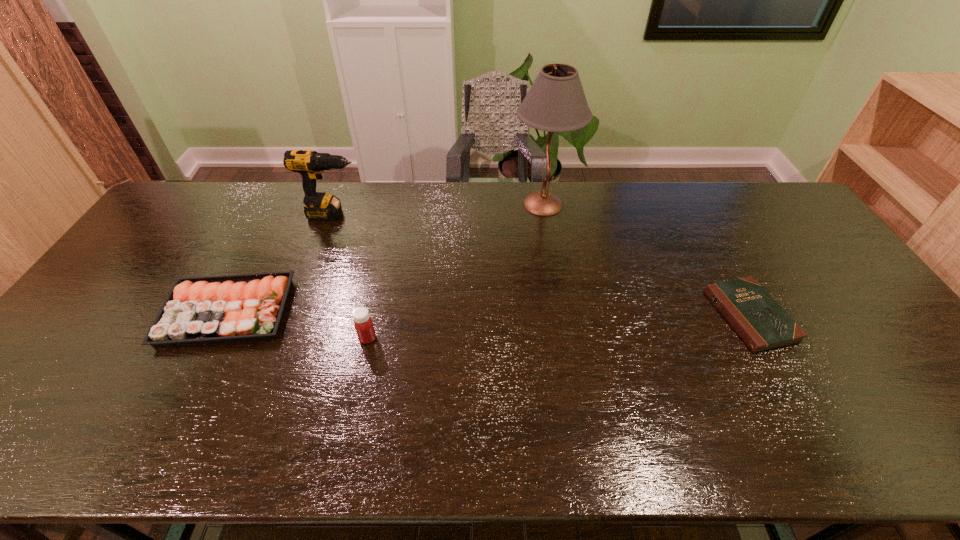
This screenshot has height=540, width=960. Find the location of `vacant space situated 0.130m on the front-facing side of the tallest object`. vacant space situated 0.130m on the front-facing side of the tallest object is located at coordinates (473, 204).

Locate an element on the screen. The image size is (960, 540). vacant region located at the tip of the drill is located at coordinates pyautogui.click(x=405, y=214).

In order to click on vacant space situated on the front of the third object from left to right in this screenshot , I will do `click(346, 441)`.

Where is `free space located 0.090m on the right of the second shortest object`? This screenshot has height=540, width=960. free space located 0.090m on the right of the second shortest object is located at coordinates (324, 312).

Locate an element on the screen. This screenshot has height=540, width=960. vacant space located 0.070m on the right of the shortest object is located at coordinates (x=811, y=316).

You are a GUI agent. You are given a task and a screenshot of the screen. Output one action in this format:
    pyautogui.click(x=<x>, y=<y>)
    Task: Click on the table lamp at the far edge
    Image resolution: width=960 pixels, height=540 pixels.
    Given the screenshot: What is the action you would take?
    pyautogui.click(x=556, y=102)

Find the location of `drill at the far edge`. drill at the far edge is located at coordinates (310, 164).

In the image, there is a desktop. Where is `vacant space at the far edge`? The width and height of the screenshot is (960, 540). vacant space at the far edge is located at coordinates (639, 213).

You are a GUI agent. You are given a task and a screenshot of the screen. Output one action in this format:
    pyautogui.click(x=<x>, y=<y>)
    Task: Click on the vacant space at the near edge of the desktop
    
    Given the screenshot: What is the action you would take?
    pyautogui.click(x=870, y=437)

In the image, there is a desktop. At what (x,y) coordinates should I click in order to perform the action: click on free space at the right edge. Please return your answer as a coordinate pair (x, y). The height and width of the screenshot is (540, 960). Looking at the image, I should click on (861, 297).